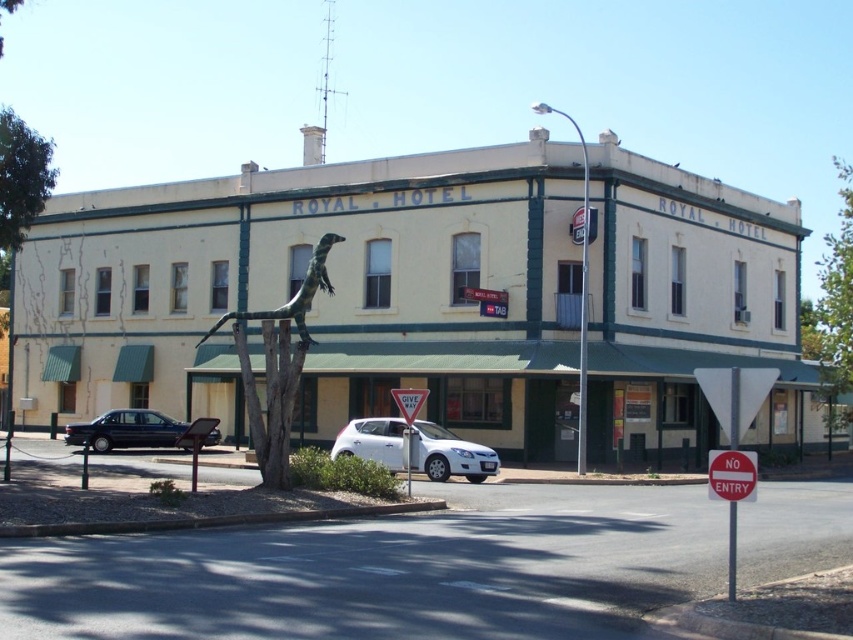
Does green textured lizard at center have a larger size compared to red plastic sign at center?

Correct, green textured lizard at center is larger in size than red plastic sign at center.

Is green textured lizard at center smaller than red plastic sign at center?

No, green textured lizard at center is not smaller than red plastic sign at center.

Image resolution: width=853 pixels, height=640 pixels. I want to click on green textured lizard at center, so click(293, 292).

Between white matte hatchback at center and white plastic triangle at center, which one has less height?

Standing shorter between the two is white matte hatchback at center.

Does white matte hatchback at center lie behind white plastic triangle at center?

Yes, white matte hatchback at center is further from the viewer.

Is point (442, 458) more distant than point (402, 388)?

No.

Find the location of a particular element. white matte hatchback at center is located at coordinates (450, 454).

Based on the photo, who is higher up, green textured lizard at center or white plastic triangle at center?

green textured lizard at center

Does green textured lizard at center have a lesser width compared to white plastic triangle at center?

In fact, green textured lizard at center might be wider than white plastic triangle at center.

Is point (296, 321) positioned behind point (413, 392)?

No, (296, 321) is in front of (413, 392).

This screenshot has width=853, height=640. I want to click on green textured lizard at center, so click(293, 292).